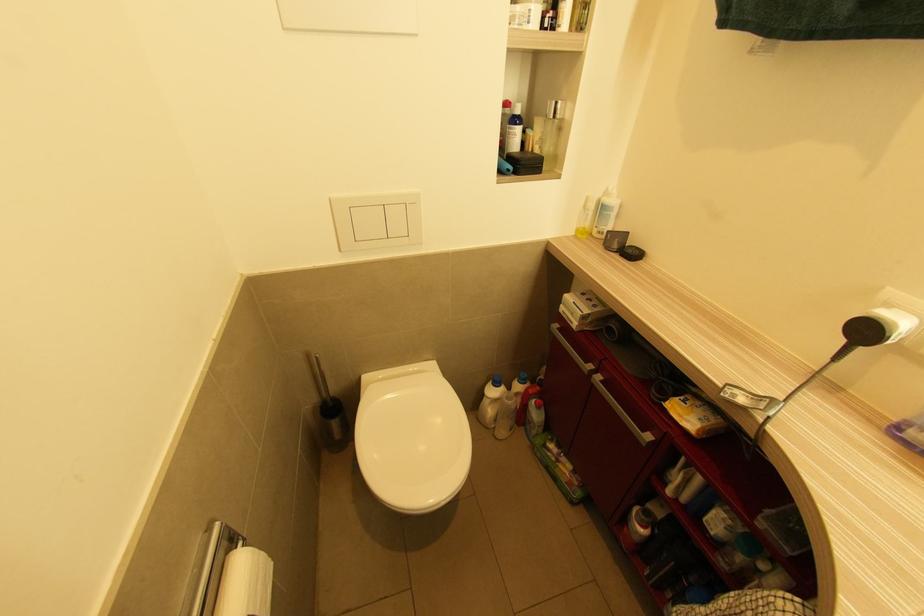
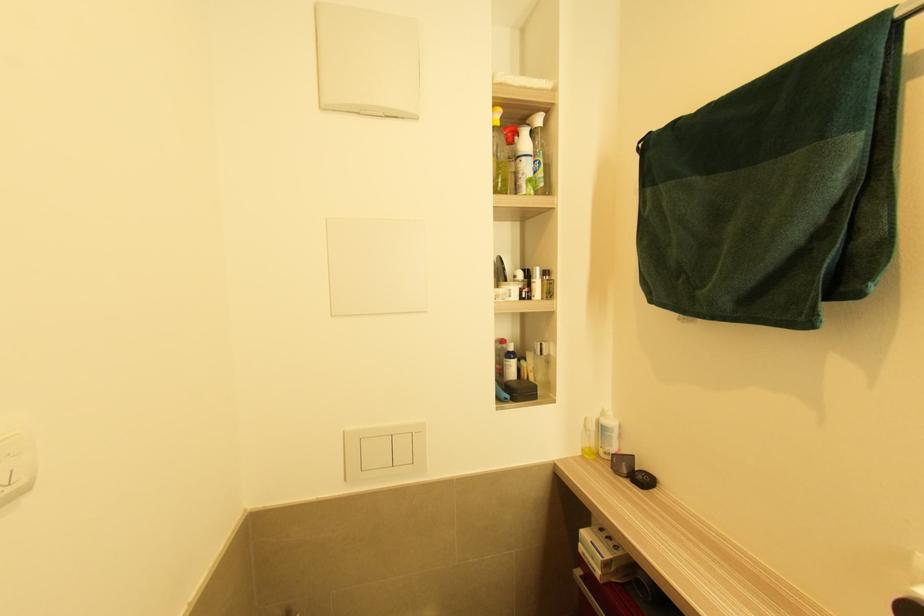
Question: How did the camera likely rotate?

Choices:
 (A) Left
 (B) Right
 (C) Up
 (D) Down

Answer: (C)